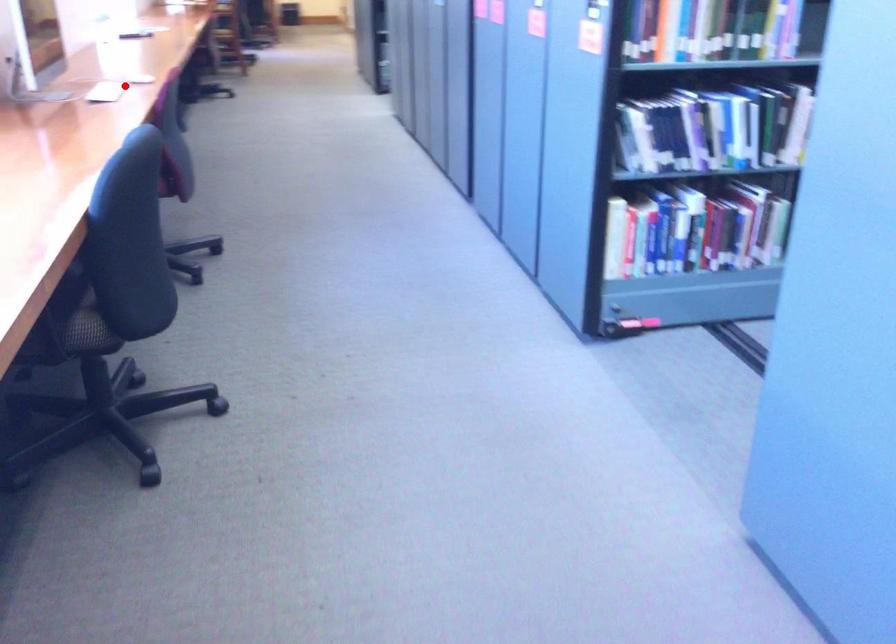
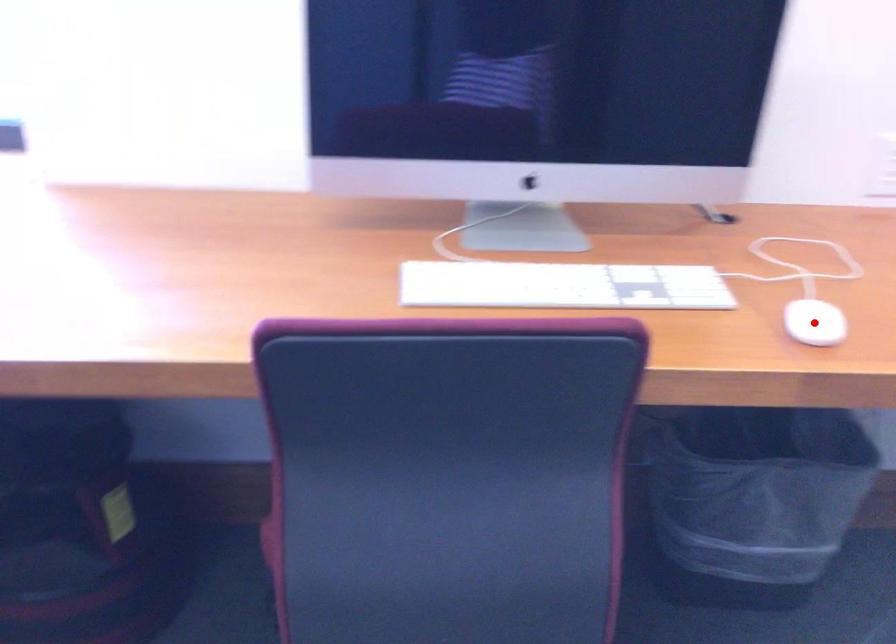
I am providing you with two images of the same scene from different viewpoints. A red point is marked on the first image and another point is marked on the second image. Is the red point in image1 aligned with the point shown in image2?

No